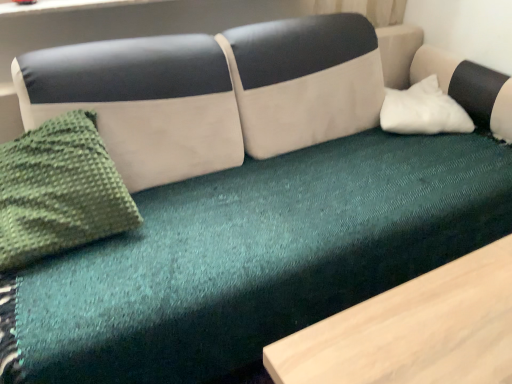
Question: Is green knitted throw pillow at left inside or outside of white soft pillow at right?

Choices:
 (A) inside
 (B) outside

Answer: (B)

Question: From a real-world perspective, relative to white soft pillow at right, is green knitted throw pillow at left vertically above or below?

Choices:
 (A) below
 (B) above

Answer: (B)

Question: Considering the positions of green knitted throw pillow at left and white soft pillow at right in the image, is green knitted throw pillow at left wider or thinner than white soft pillow at right?

Choices:
 (A) wide
 (B) thin

Answer: (B)

Question: Is white soft pillow at right situated inside green knitted throw pillow at left or outside?

Choices:
 (A) inside
 (B) outside

Answer: (B)

Question: Is white soft pillow at right wider or thinner than green knitted throw pillow at left?

Choices:
 (A) wide
 (B) thin

Answer: (A)

Question: In the image, is white soft pillow at right positioned in front of or behind green knitted throw pillow at left?

Choices:
 (A) behind
 (B) front

Answer: (A)

Question: Looking at the image, does white soft pillow at right seem bigger or smaller compared to green knitted throw pillow at left?

Choices:
 (A) big
 (B) small

Answer: (B)